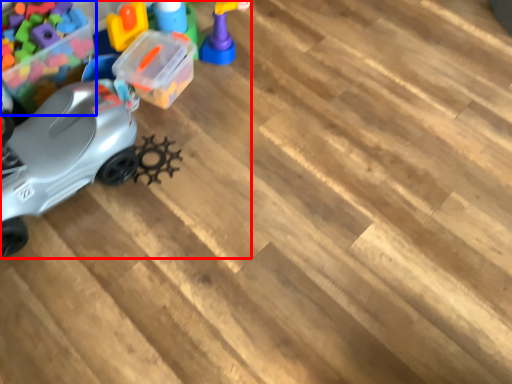
Question: Which object appears closest to the camera in this image, toy (highlighted by a red box) or toy (highlighted by a blue box)?

Choices:
 (A) toy
 (B) toy

Answer: (A)